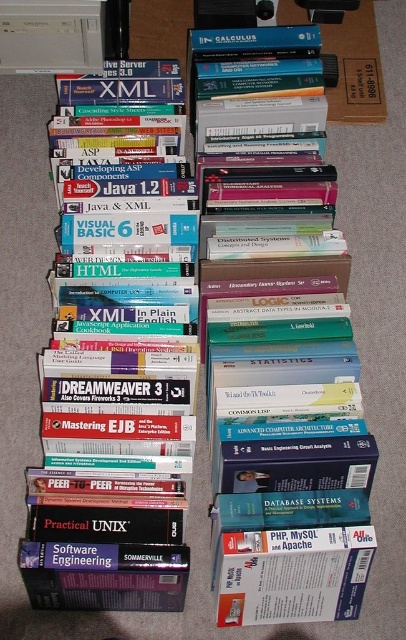
Question: Is hardcover book at center thinner than hardcover book at left?

Choices:
 (A) no
 (B) yes

Answer: (B)

Question: Estimate the real-world distances between objects in this image. Which object is closer to the hardcover book at left?

Choices:
 (A) matte white book at lower center
 (B) hardcover book at center

Answer: (B)

Question: Is hardcover book at center wider than matte white book at lower center?

Choices:
 (A) no
 (B) yes

Answer: (B)

Question: Which of the following is the closest to the observer?

Choices:
 (A) (297, 612)
 (B) (313, 401)

Answer: (A)

Question: Is hardcover book at center to the right of matte white book at lower center from the viewer's perspective?

Choices:
 (A) no
 (B) yes

Answer: (A)

Question: Which object is positioned farthest from the matte white book at lower center?

Choices:
 (A) hardcover book at left
 (B) hardcover book at center

Answer: (A)